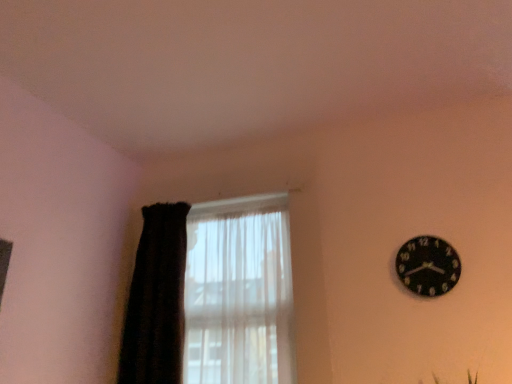
Question: Is the depth of translucent fabric at left less than that of black fuzzy curtain at left?

Choices:
 (A) yes
 (B) no

Answer: (A)

Question: From the image's perspective, is translucent fabric at left on top of black fuzzy curtain at left?

Choices:
 (A) no
 (B) yes

Answer: (A)

Question: Is translucent fabric at left not close to black fuzzy curtain at left?

Choices:
 (A) no
 (B) yes

Answer: (A)

Question: Considering the relative sizes of translucent fabric at left and black fuzzy curtain at left in the image provided, is translucent fabric at left thinner than black fuzzy curtain at left?

Choices:
 (A) yes
 (B) no

Answer: (A)

Question: Considering the relative sizes of translucent fabric at left and black fuzzy curtain at left in the image provided, is translucent fabric at left smaller than black fuzzy curtain at left?

Choices:
 (A) yes
 (B) no

Answer: (B)

Question: Is translucent fabric at left outside of black fuzzy curtain at left?

Choices:
 (A) yes
 (B) no

Answer: (B)

Question: Is black fuzzy curtain at left not close to black matte clock at upper right?

Choices:
 (A) yes
 (B) no

Answer: (A)

Question: From a real-world perspective, is black fuzzy curtain at left on top of black matte clock at upper right?

Choices:
 (A) no
 (B) yes

Answer: (A)

Question: Can you confirm if black fuzzy curtain at left is positioned to the left of black matte clock at upper right?

Choices:
 (A) no
 (B) yes

Answer: (B)

Question: Is the position of black fuzzy curtain at left more distant than that of black matte clock at upper right?

Choices:
 (A) no
 (B) yes

Answer: (B)

Question: Is black fuzzy curtain at left smaller than black matte clock at upper right?

Choices:
 (A) no
 (B) yes

Answer: (A)

Question: Considering the relative sizes of black fuzzy curtain at left and black matte clock at upper right in the image provided, is black fuzzy curtain at left wider than black matte clock at upper right?

Choices:
 (A) yes
 (B) no

Answer: (A)

Question: Could you tell me if translucent fabric at left is turned towards black matte clock at upper right?

Choices:
 (A) yes
 (B) no

Answer: (B)